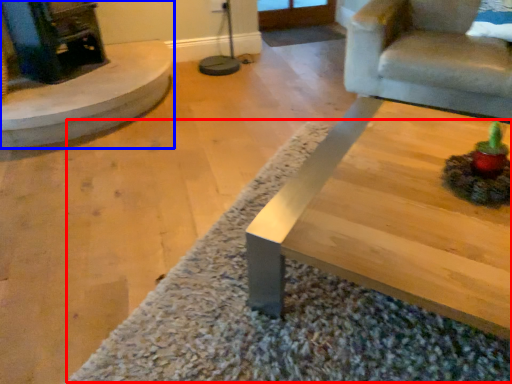
Question: Which object appears closest to the camera in this image, mat (highlighted by a red box) or fireplace (highlighted by a blue box)?

Choices:
 (A) mat
 (B) fireplace

Answer: (A)